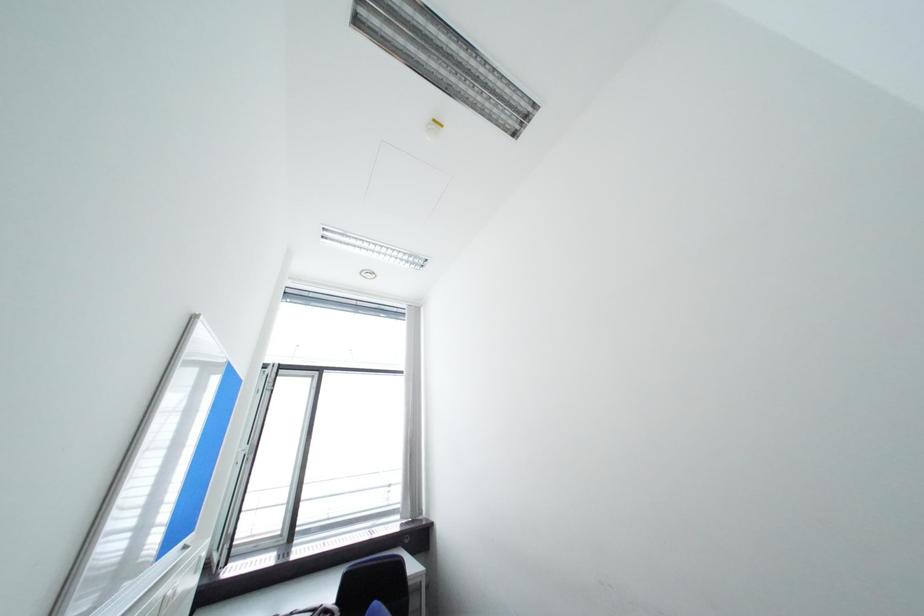
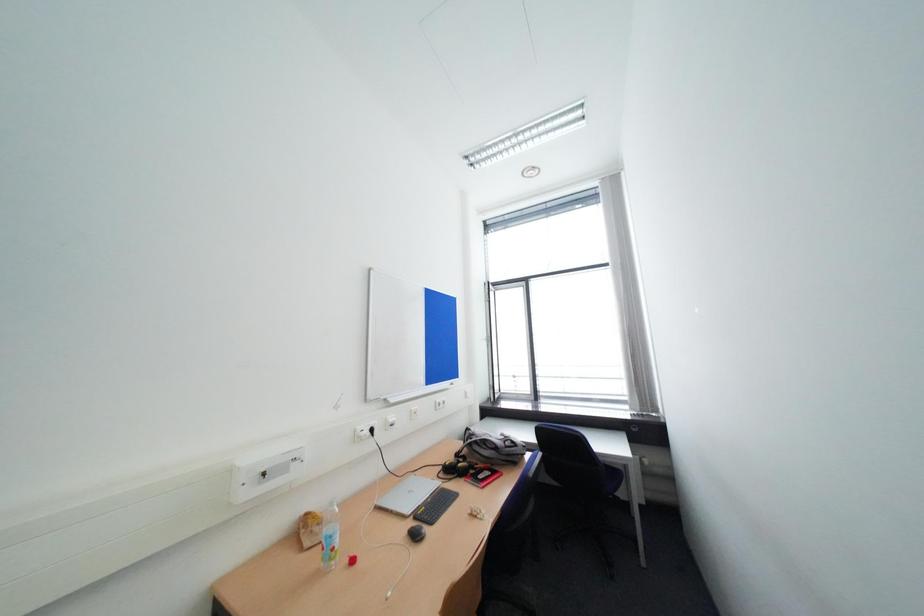
Question: The camera is either moving clockwise (left) or counter-clockwise (right) around the object. The first image is from the beginning of the video and the second image is from the end. Is the camera moving left or right when shooting the video?

Choices:
 (A) Left
 (B) Right

Answer: (B)